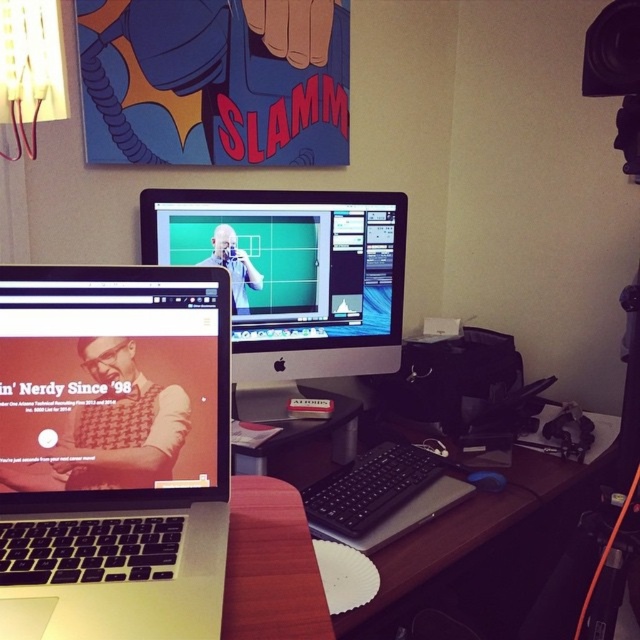
In the scene shown: You are organizing the desk and want to move the silver metallic laptop at lower left to the right side of the black plastic computer desk at center. Is the laptop currently blocking access to the desk surface behind it?

The silver metallic laptop at lower left is in front of the black plastic computer desk at center, so moving it would allow access to the desk surface behind it.

You are setting up a new monitor stand in the workspace. The stand requires that the center of the monitor must be placed at coordinates between 0.6 and 0.8 on the x and y axes. Can the silver metallic laptop at lower left be placed at its current position without violating the stand requirements?

The silver metallic laptop at lower left is positioned at point (115,448). The y coordinate 0.181 is below the required minimum of 0.6 for the monitor stand, so placing the laptop here would violate the stand requirements.

You are a delivery person who needs to place a small package exactly halfway between the two points marked on the desk. The coordinates provided are point0 at [83,588] and point1 at 0.679, 0.452. Can you determine the coordinates for the midpoint?

The midpoint between point0 at [83,588] and point1 at 0.679, 0.452 would be at coordinates calculated by averaging the x and y values. The midpoint is at x coordinate 0.7995 and y coordinate 0.2915. Therefore, the coordinates are approximately 0.800, 0.292.